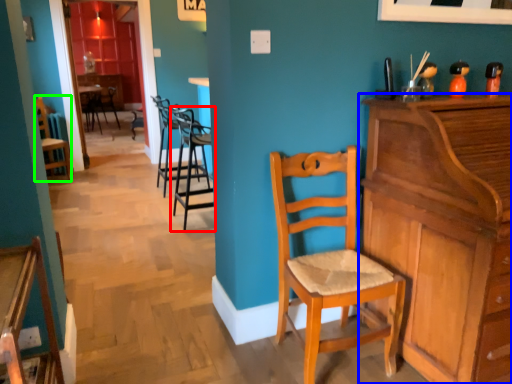
Question: Based on their relative distances, which object is nearer to chair (highlighted by a red box)? Choose from cabinetry (highlighted by a blue box) and chair (highlighted by a green box).

Choices:
 (A) cabinetry
 (B) chair

Answer: (B)